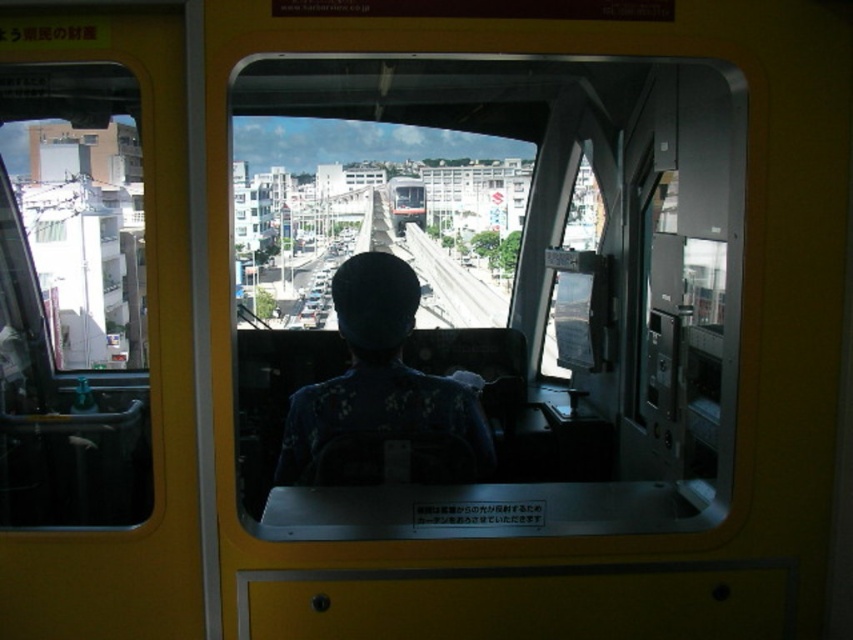
You are a passenger sitting in the train cabin. You want to look outside through the transparent glass train window at upper left but need to pass by the dark blue uniform at center. Is the window in front of or behind the uniform?

The transparent glass train window at upper left is in front of the dark blue uniform at center, so the window is in front of the uniform.

Looking at this image, you are a passenger in the train cabin and want to see the outside view through the transparent glass train window at upper left while also checking the dark blue uniform at center. Which object allows you to see through it?

The transparent glass train window at upper left allows you to see through it because it is made of transparent glass, while the dark blue uniform at center is an opaque object.

You are a passenger sitting in the train cabin and want to see the outside view. Is the transparent glass train window at center above or below the dark blue uniform at center?

The transparent glass train window at center is located above the dark blue uniform at center, so you can look up through the window to see the outside view.